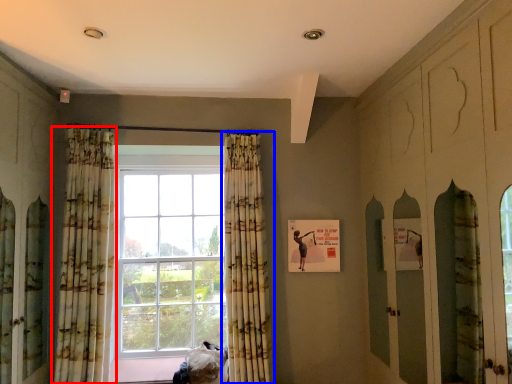
Question: Which of the following is the farthest to the observer, curtain (highlighted by a red box) or curtain (highlighted by a blue box)?

Choices:
 (A) curtain
 (B) curtain

Answer: (B)